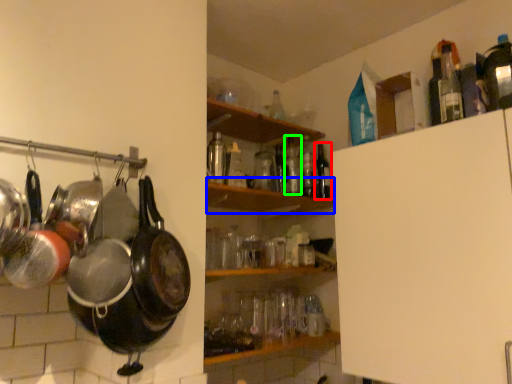
Question: Estimate the real-world distances between objects in this image. Which object is farther from bottle (highlighted by a red box), shelf (highlighted by a blue box) or bottle (highlighted by a green box)?

Choices:
 (A) shelf
 (B) bottle

Answer: (A)